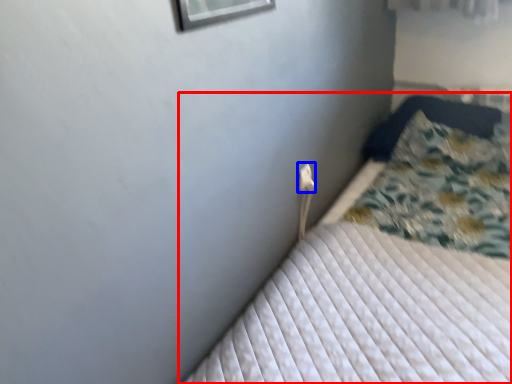
Question: Which of the following is the closest to the observer, bed (highlighted by a red box) or electric outlet (highlighted by a blue box)?

Choices:
 (A) bed
 (B) electric outlet

Answer: (A)